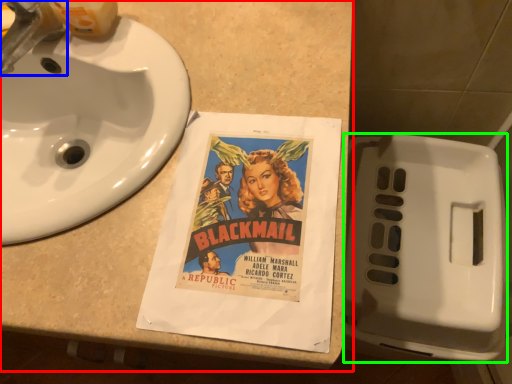
Question: Based on their relative distances, which object is nearer to counter top (highlighted by a red box)? Choose from faucet (highlighted by a blue box) and toilet (highlighted by a green box).

Choices:
 (A) faucet
 (B) toilet

Answer: (A)